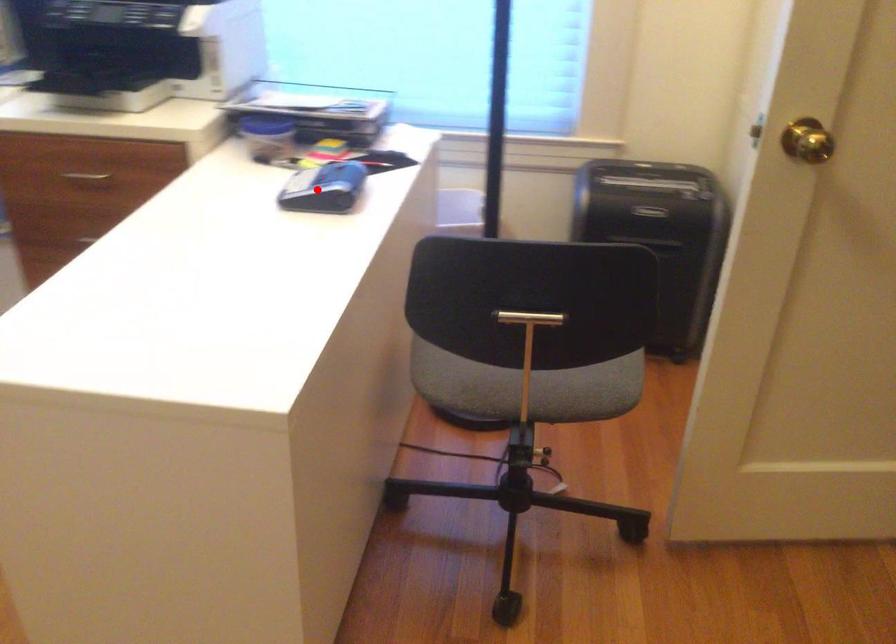
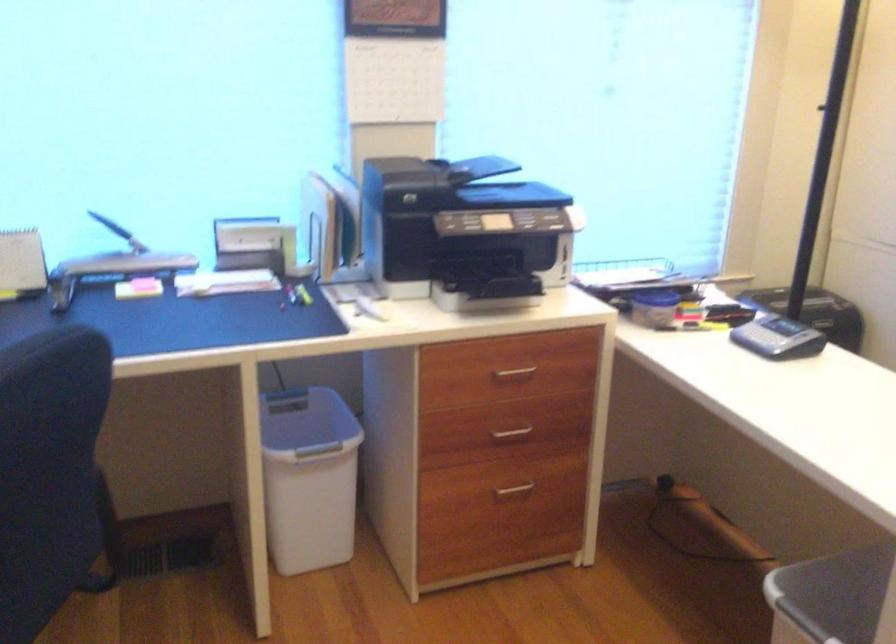
Question: A red point is marked in image1. In image2, is the corresponding 3D point closer to the camera or farther? Reply with the corresponding letter.

Choices:
 (A) The corresponding 3D point is closer.
 (B) The corresponding 3D point is farther.

Answer: (B)